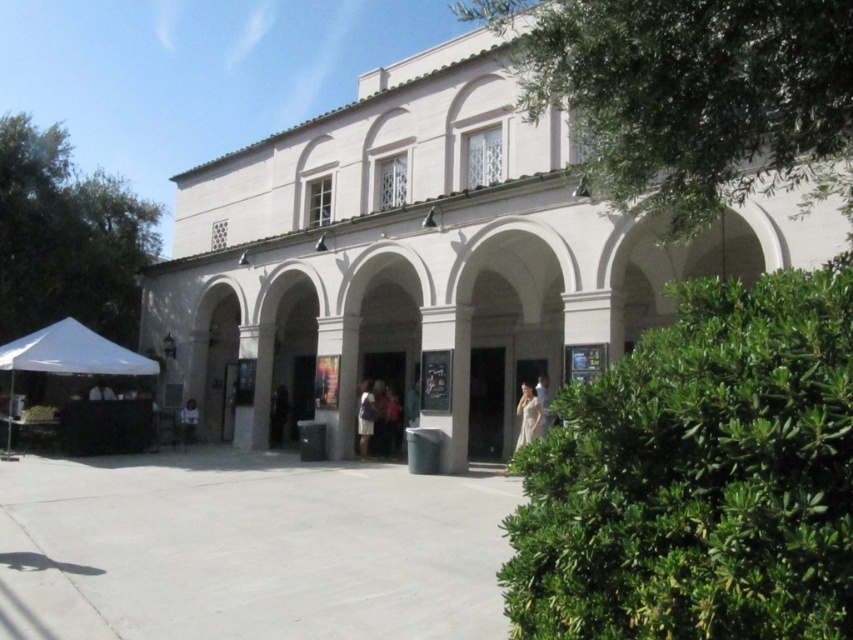
Question: Is white fabric canopy at lower left positioned at the back of white fabric bag at center?

Choices:
 (A) yes
 (B) no

Answer: (B)

Question: Which object is positioned closest to the white fabric bag at center?

Choices:
 (A) green leafy bush at center
 (B) white silk dress at center

Answer: (B)

Question: Does green leafy bush at center come behind white fabric canopy at lower left?

Choices:
 (A) yes
 (B) no

Answer: (B)

Question: Which point is closer to the camera taking this photo?

Choices:
 (A) (74, 320)
 (B) (183, 416)
 (C) (457, 442)
 (D) (769, 506)

Answer: (D)

Question: Among these points, which one is farthest from the camera?

Choices:
 (A) (364, 417)
 (B) (39, 349)

Answer: (A)

Question: Is white fabric canopy at lower left wider than white silk dress at center?

Choices:
 (A) yes
 (B) no

Answer: (A)